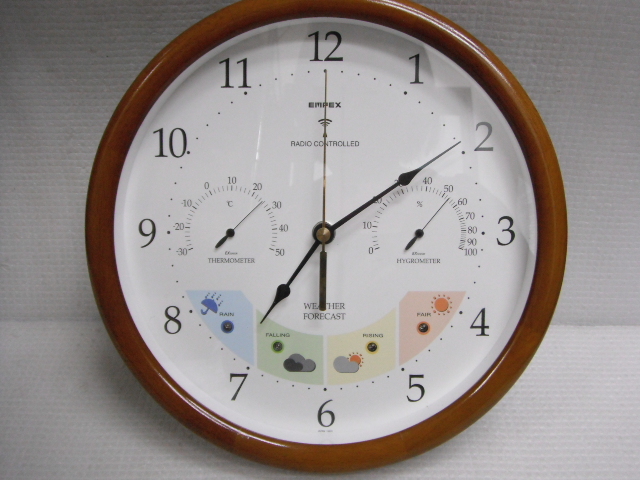
You are a GUI agent. You are given a task and a screenshot of the screen. Output one action in this format:
    pyautogui.click(x=<x>, y=<y>)
    Task: Click on the clock
    The width and height of the screenshot is (640, 480).
    Given the screenshot: What is the action you would take?
    pyautogui.click(x=240, y=223)